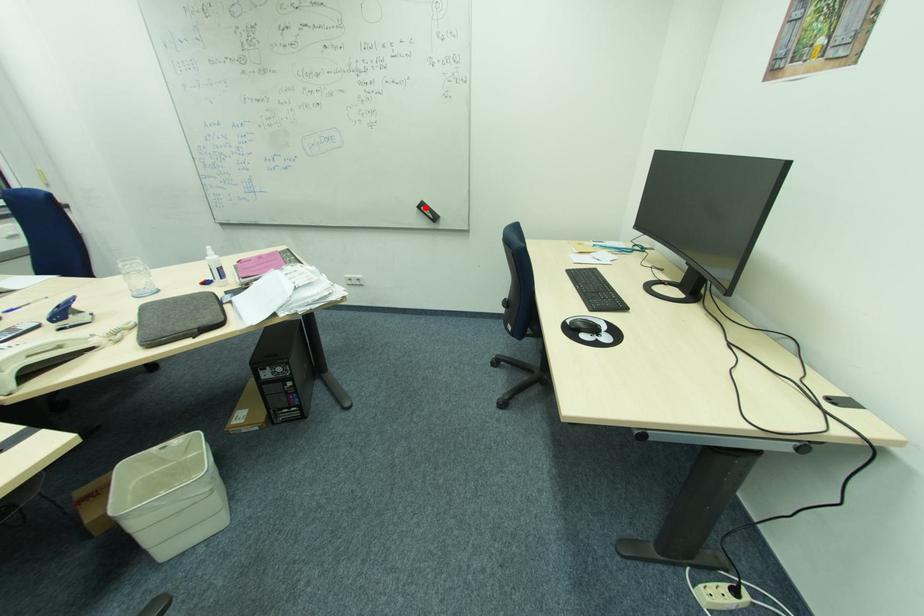
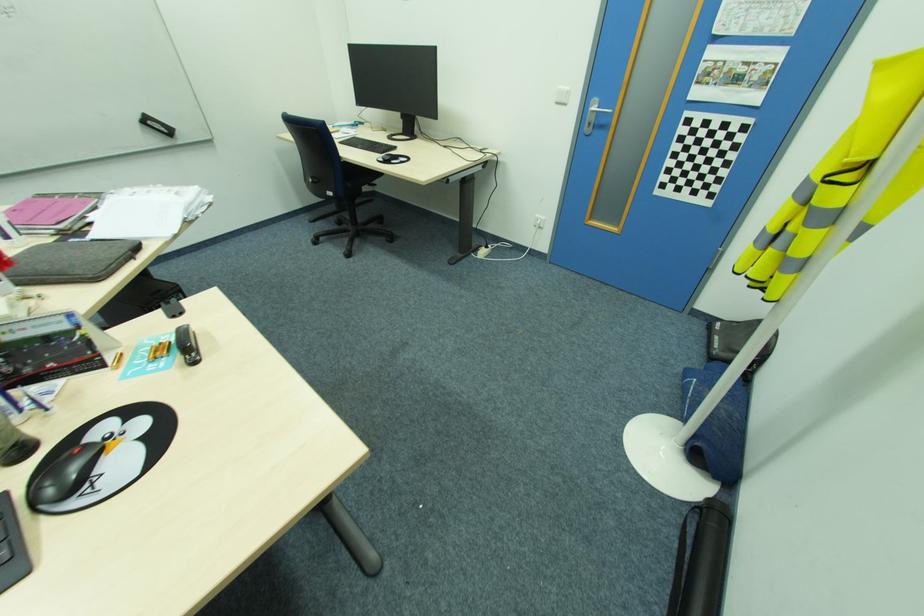
Question: I am providing you with two images of the same scene from different viewpoints. Given a red point in image1, look at the same physical point in image2. Is it:

Choices:
 (A) Closer to the viewpoint
 (B) Farther from the viewpoint

Answer: (B)